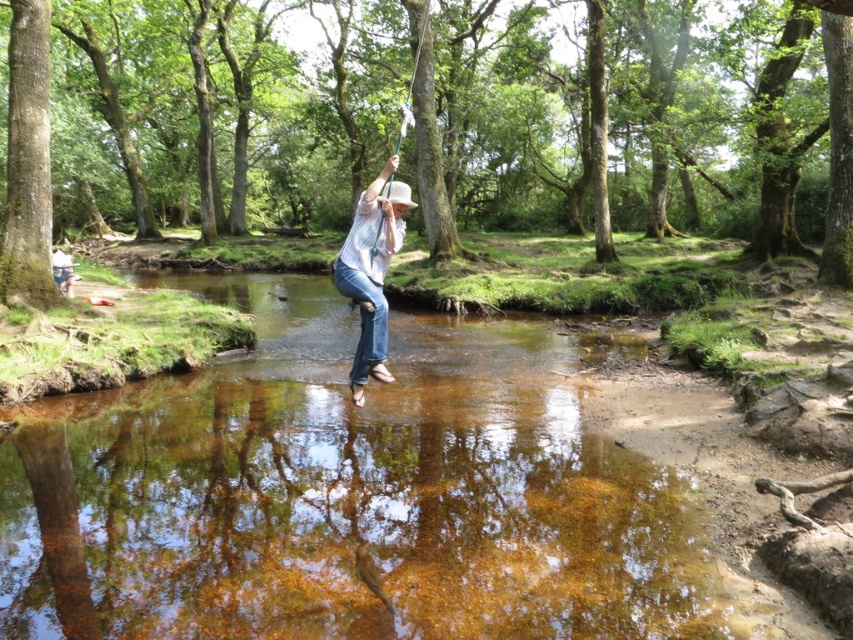
Question: Which object appears closest to the camera in this image?

Choices:
 (A) white cotton shirt at center
 (B) green smooth bark tree at center

Answer: (A)

Question: Is green rough bark tree at left wider than white cotton shirt at center?

Choices:
 (A) yes
 (B) no

Answer: (B)

Question: Considering the real-world distances, which object is closest to the white cotton shirt at center?

Choices:
 (A) green smooth bark tree at center
 (B) green rough bark tree at left

Answer: (B)

Question: Can you confirm if green smooth bark tree at center is positioned above green rough bark tree at left?

Choices:
 (A) yes
 (B) no

Answer: (A)

Question: Can you confirm if green rough bark tree at left is thinner than white cotton shirt at center?

Choices:
 (A) yes
 (B) no

Answer: (A)

Question: Which point is closer to the camera?

Choices:
 (A) 13,172
 (B) 16,81

Answer: (A)